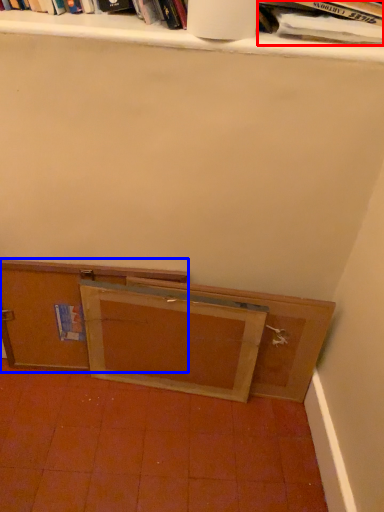
Question: Among these objects, which one is nearest to the camera, book (highlighted by a red box) or cabinetry (highlighted by a blue box)?

Choices:
 (A) book
 (B) cabinetry

Answer: (A)